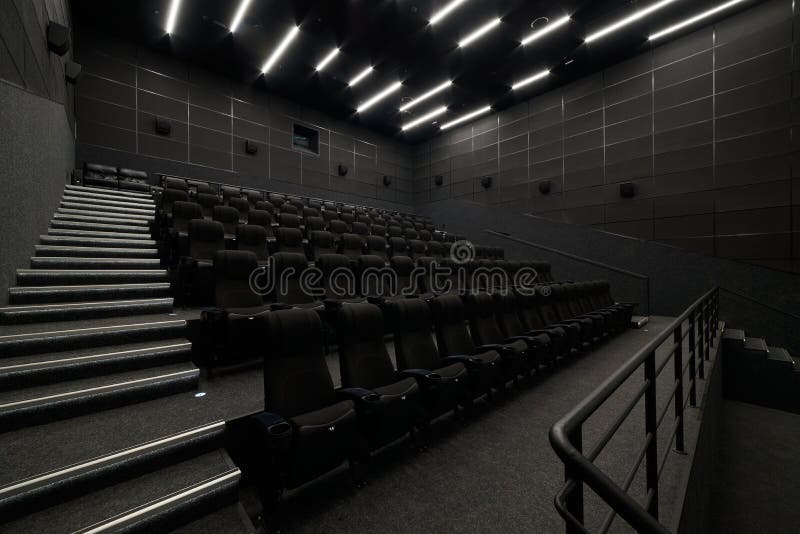
Identify the location of speaker. (58, 45), (74, 70), (161, 125), (246, 149), (337, 174), (386, 185), (433, 184), (489, 183), (546, 193), (629, 193).